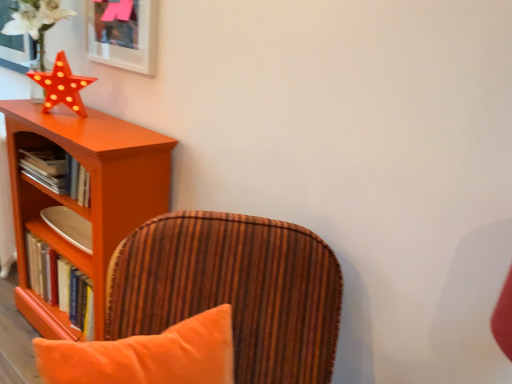
Question: Looking at the image, does matte white picture frame at upper left seem bigger or smaller compared to orange wood shelf at left?

Choices:
 (A) small
 (B) big

Answer: (A)

Question: Considering the relative positions of matte white picture frame at upper left and orange wood shelf at left in the image provided, is matte white picture frame at upper left to the left or to the right of orange wood shelf at left?

Choices:
 (A) left
 (B) right

Answer: (B)

Question: Which is farther from the hardcover books at left, which appears as the second book when ordered from the bottom?

Choices:
 (A) matte orange star at upper left
 (B) hardcover book at left, the 2th book in the top-to-bottom sequence
 (C) matte white picture frame at upper left
 (D) orange wood shelf at left
 (E) velvet orange chair at center

Answer: (E)

Question: Considering the real-world distances, which object is farthest from the hardcover book at left, the 2th book in the top-to-bottom sequence?

Choices:
 (A) matte white picture frame at upper left
 (B) orange wood shelf at left
 (C) hardcover books at left, the first book when ordered from top to bottom
 (D) velvet orange chair at center
 (E) matte orange star at upper left

Answer: (A)